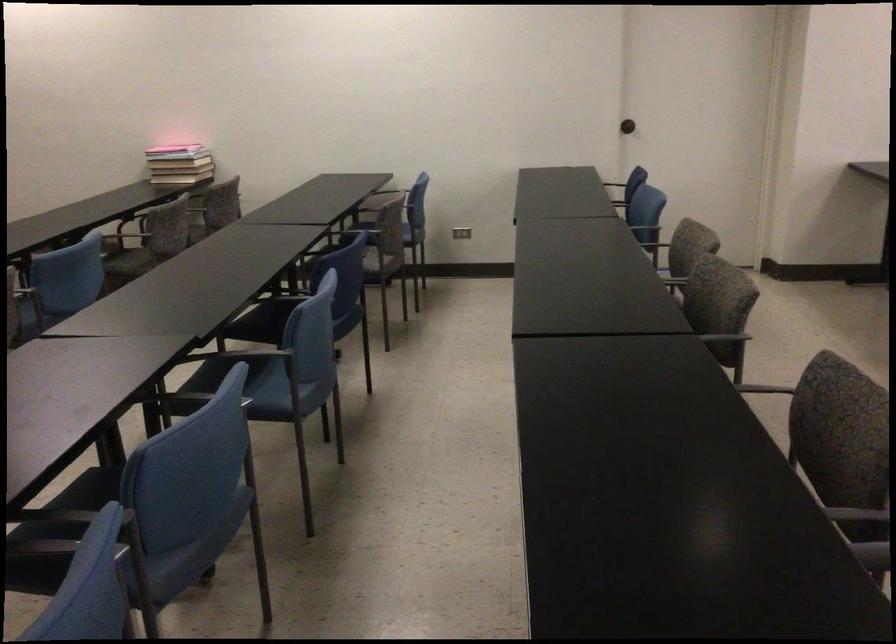
Find the location of a particular element. This screenshot has height=644, width=896. round door handle is located at coordinates (626, 126).